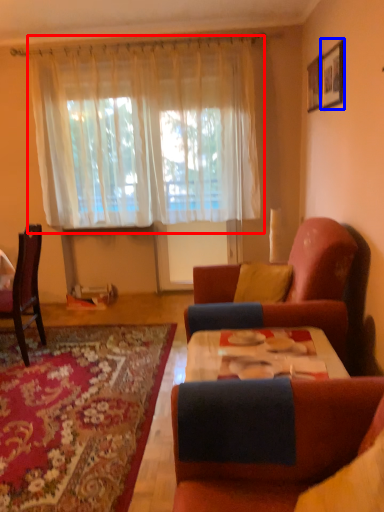
Question: Which object is closer to the camera taking this photo, curtain (highlighted by a red box) or picture frame (highlighted by a blue box)?

Choices:
 (A) curtain
 (B) picture frame

Answer: (B)